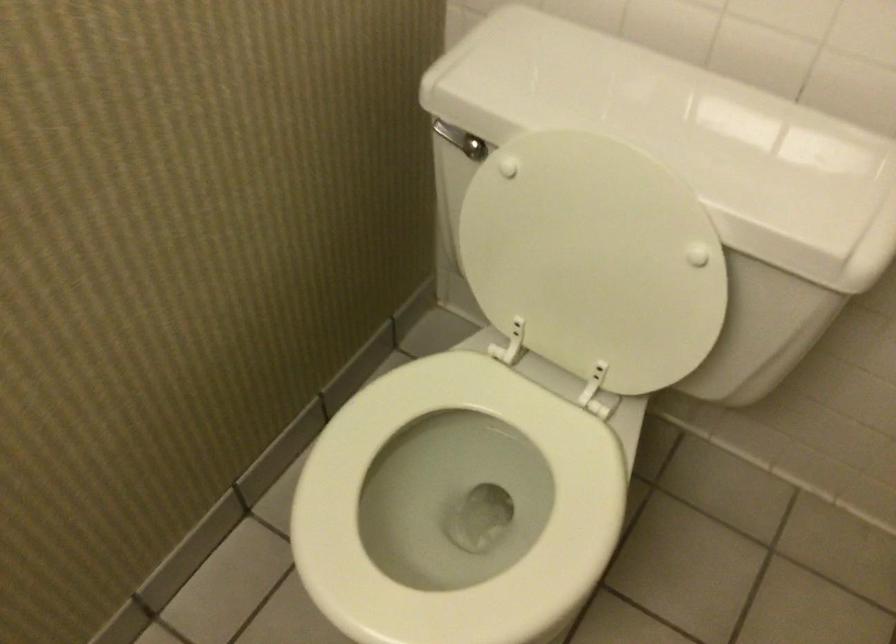
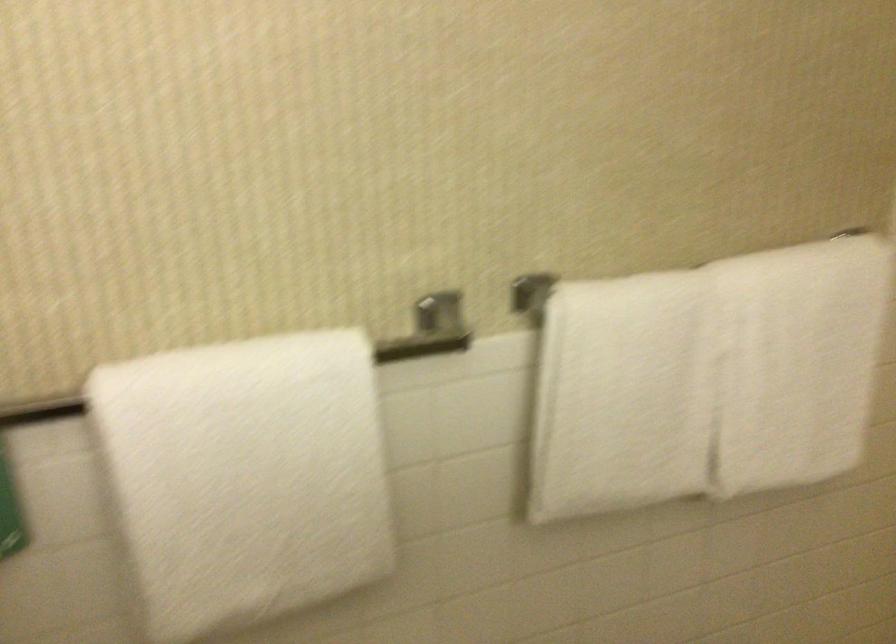
Question: The images are taken continuously from a first-person perspective. In which direction is your viewpoint rotating?

Choices:
 (A) Left
 (B) Right
 (C) Up
 (D) Down

Answer: (B)